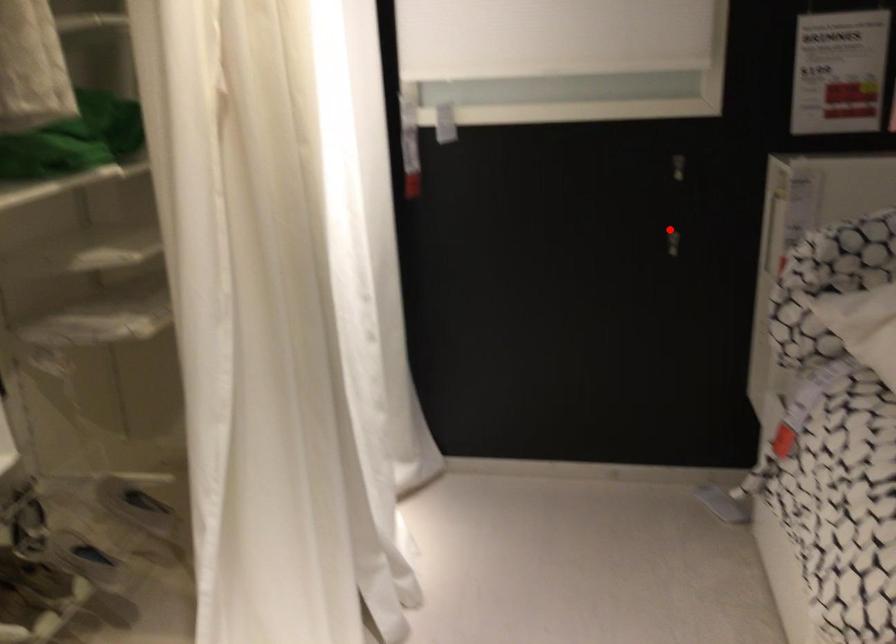
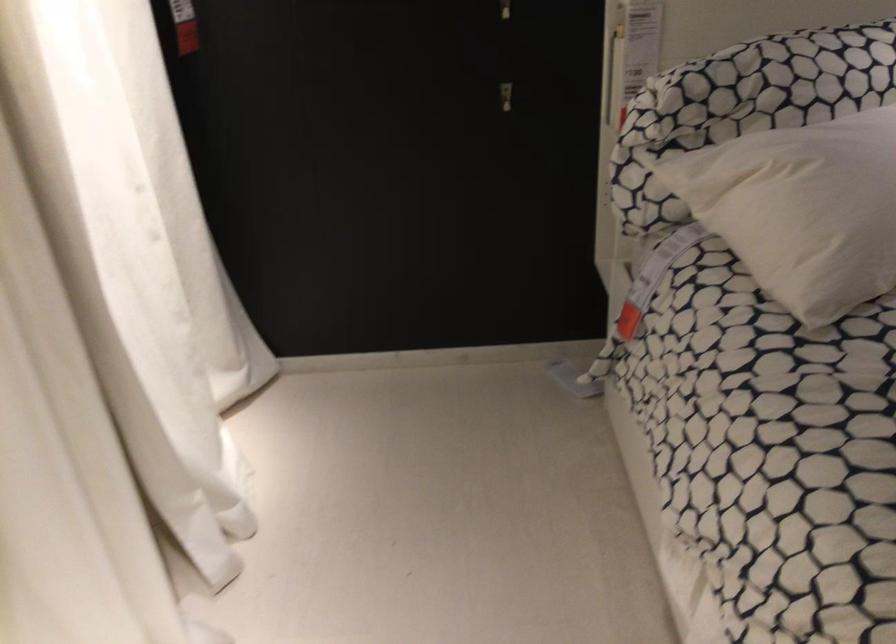
Question: I am providing you with two images of the same scene from different viewpoints. A red point is shown in image1. For the corresponding object point in image2, is it positioned nearer or farther from the camera?

Choices:
 (A) Nearer
 (B) Farther

Answer: (A)